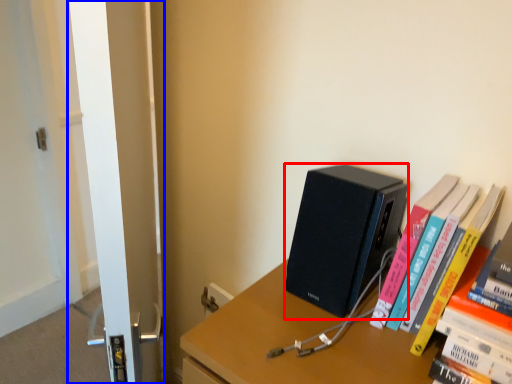
Question: Which of the following is the farthest to the observer, computer (highlighted by a red box) or screen door (highlighted by a blue box)?

Choices:
 (A) computer
 (B) screen door

Answer: (A)